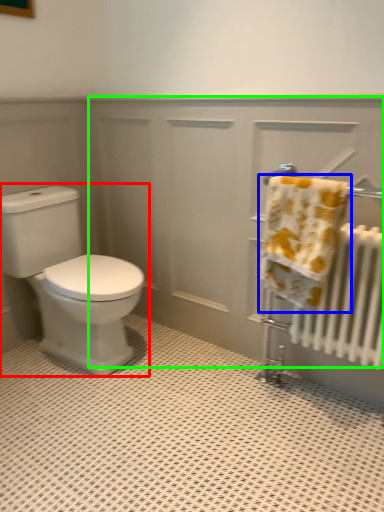
Question: Based on their relative distances, which object is nearer to toilet (highlighted by a red box)? Choose from towel (highlighted by a blue box) and screen door (highlighted by a green box).

Choices:
 (A) towel
 (B) screen door

Answer: (B)